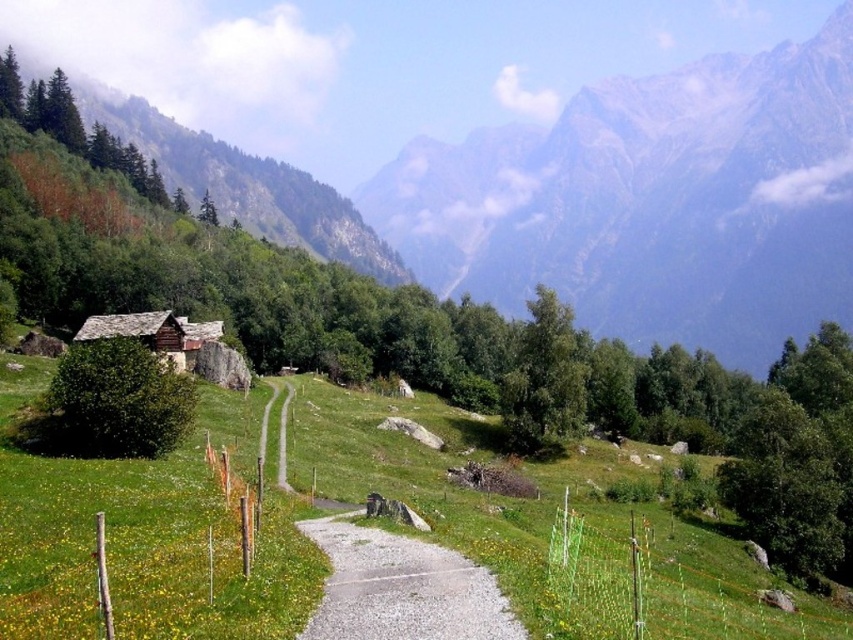
Question: From the image, what is the correct spatial relationship of gray rocky mountain at upper center in relation to gravelly path at center?

Choices:
 (A) above
 (B) below

Answer: (A)

Question: Considering the relative positions of gravelly dirt path at center and gravelly path at center in the image provided, where is gravelly dirt path at center located with respect to gravelly path at center?

Choices:
 (A) left
 (B) right

Answer: (A)

Question: Which object is the closest to the gravelly path at center?

Choices:
 (A) rustic stone hut at lower left
 (B) green grassy at lower left
 (C) gray rocky mountain at upper center
 (D) gravelly dirt path at center

Answer: (D)

Question: Which object is the closest to the gray rocky mountain at upper center?

Choices:
 (A) gravelly path at center
 (B) green grassy at lower left
 (C) rustic stone hut at lower left

Answer: (B)

Question: Does green grassy at lower left have a greater width compared to rustic stone hut at lower left?

Choices:
 (A) yes
 (B) no

Answer: (A)

Question: Which of the following is the farthest from the observer?

Choices:
 (A) (410, 538)
 (B) (824, 240)
 (C) (416, 595)

Answer: (B)